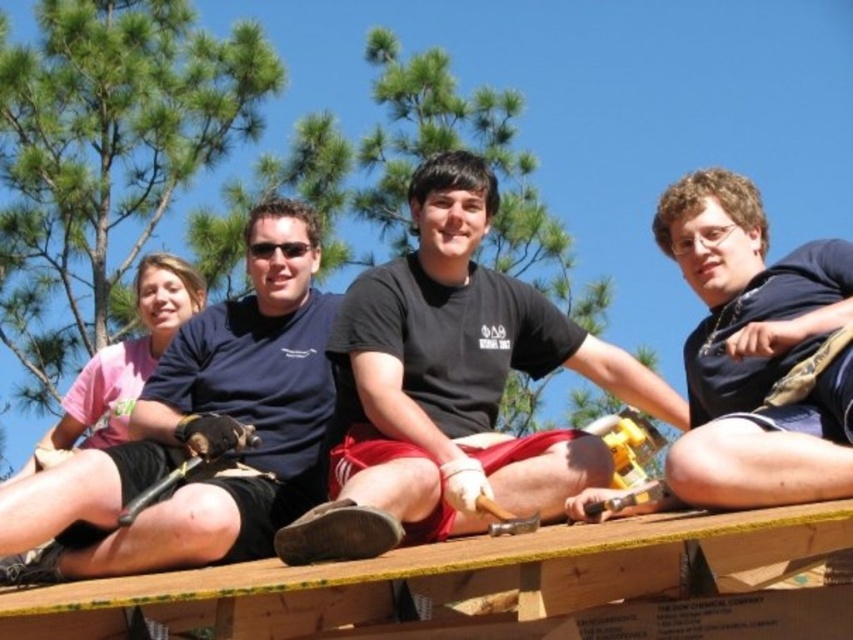
Between point (131, 552) and point (780, 342), which one is positioned in front?

Point (780, 342)

From the picture: Is matte black shirt at upper center smaller than dark blue t-shirt at center?

Actually, matte black shirt at upper center might be larger than dark blue t-shirt at center.

Is point (10, 509) less distant than point (833, 250)?

Yes, point (10, 509) is closer to viewer.

The image size is (853, 640). Find the location of `matte black shirt at upper center`. matte black shirt at upper center is located at coordinates (202, 428).

Measure the distance between point (405, 269) and camera.

51.75 meters

From the picture: Can you confirm if black matte shirt at center is taller than matte black shirt at upper center?

Yes, black matte shirt at center is taller than matte black shirt at upper center.

Describe the element at coordinates (451, 387) in the screenshot. I see `black matte shirt at center` at that location.

Locate an element on the screen. black matte shirt at center is located at coordinates (451, 387).

Can you confirm if black matte shirt at center is thinner than dark blue t-shirt at center?

No.

Is black matte shirt at center taller than dark blue t-shirt at center?

Correct, black matte shirt at center is much taller as dark blue t-shirt at center.

Which is in front, point (283, 557) or point (828, 493)?

Positioned in front is point (828, 493).

Locate an element on the screen. black matte shirt at center is located at coordinates (451, 387).